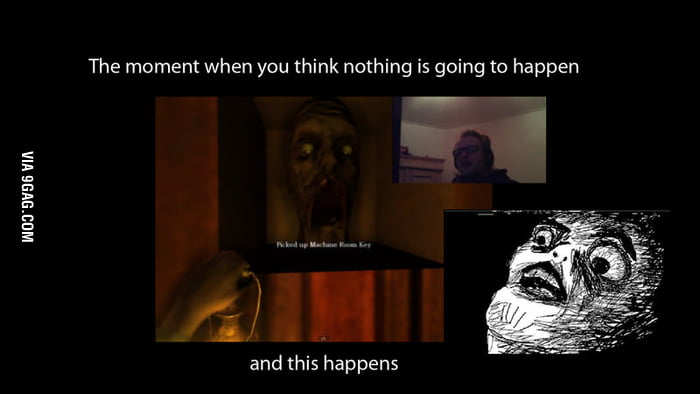
At what (x,y) coordinates should I click in order to perform the action: click on artificial light reflections. Please return your answer as a coordinate pair (x, y). This screenshot has width=700, height=394. Looking at the image, I should click on (440, 100), (535, 125).